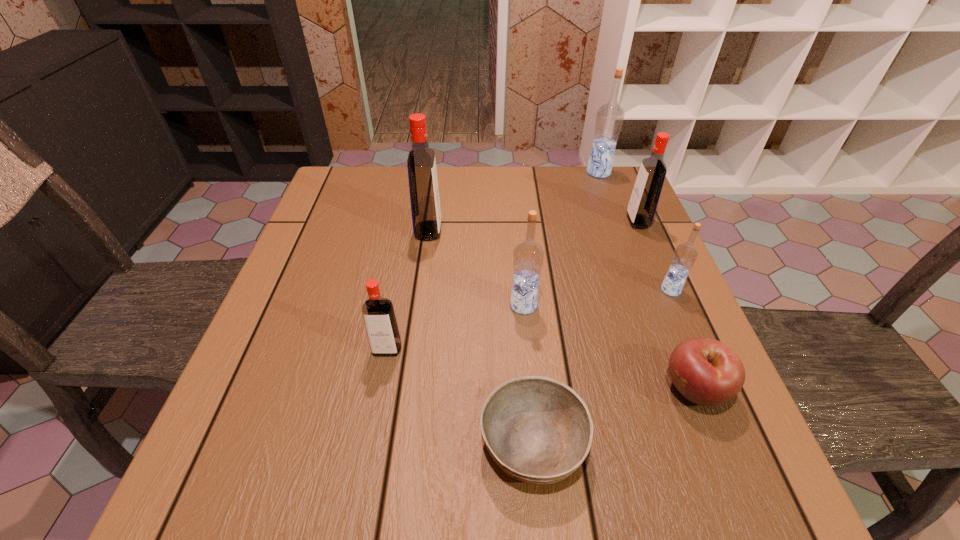
Where is `bowl`? bowl is located at coordinates (538, 430).

This screenshot has height=540, width=960. Find the location of `vacant area situated 0.140m on the left of the farthest blue vodka`. vacant area situated 0.140m on the left of the farthest blue vodka is located at coordinates (540, 172).

Find the location of a particular element. The width and height of the screenshot is (960, 540). vacant space located 0.180m on the front and back of the biggest red vodka is located at coordinates (513, 231).

Identify the location of vacant space located 0.110m on the front and back of the rightmost red vodka. (586, 221).

This screenshot has width=960, height=540. I want to click on vacant space located 0.220m on the front and back of the rightmost red vodka, so click(x=543, y=221).

What are the coordinates of `vacant region located on the front and back of the rightmost red vodka` in the screenshot? It's located at (473, 221).

You are a GUI agent. You are given a task and a screenshot of the screen. Output one action in this format:
    pyautogui.click(x=<x>, y=<y>)
    Task: Click on the vacant space located on the left of the third vodka from left to right
    Image resolution: width=960 pixels, height=540 pixels.
    Given the screenshot: What is the action you would take?
    click(439, 305)

In order to click on free region located on the front and back of the sixth farthest object in this screenshot , I will do `click(362, 482)`.

Locate an element on the screen. The width and height of the screenshot is (960, 540). vacant space situated on the front of the rightmost blue vodka is located at coordinates coord(686,326).

Find the location of a particular element. free space located on the side of the apple with the unique marking is located at coordinates point(635,389).